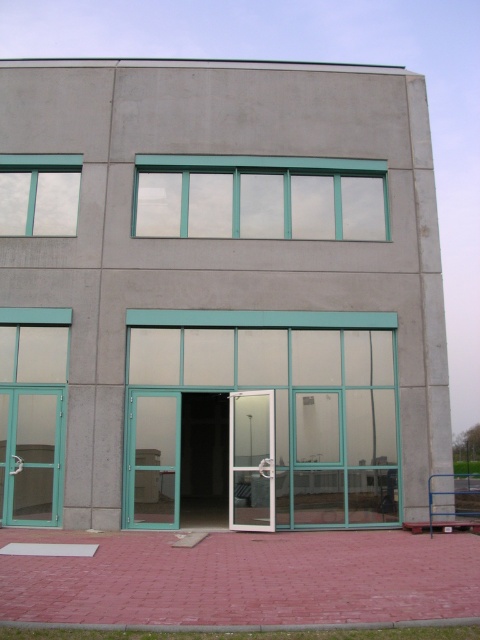
You are standing in front of the modern building and want to enter through the open double doors. Which window, the clear glass window at upper center or the matte glass window at upper left, is closer to you as you approach the building?

The clear glass window at upper center is closer to you because it is further to the viewer than the matte glass window at upper left, meaning it appears nearer in your line of sight as you approach the building.